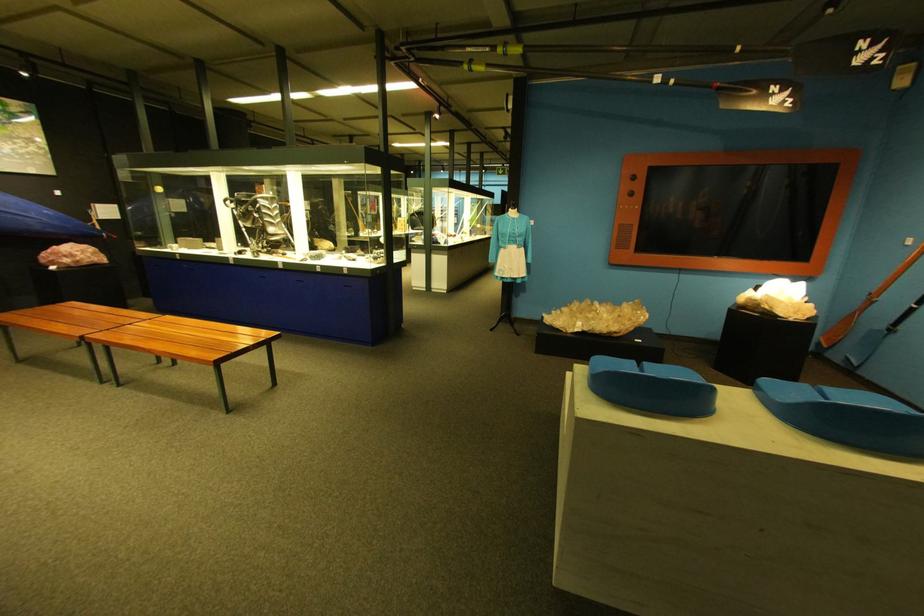
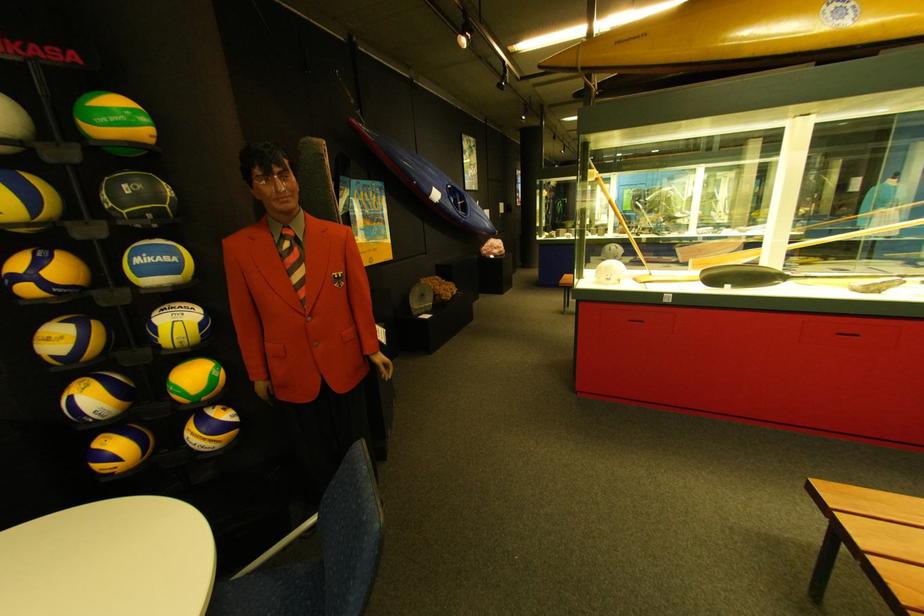
Locate, in the second image, the point that corresponds to point 59,262 in the first image.

(500, 254)